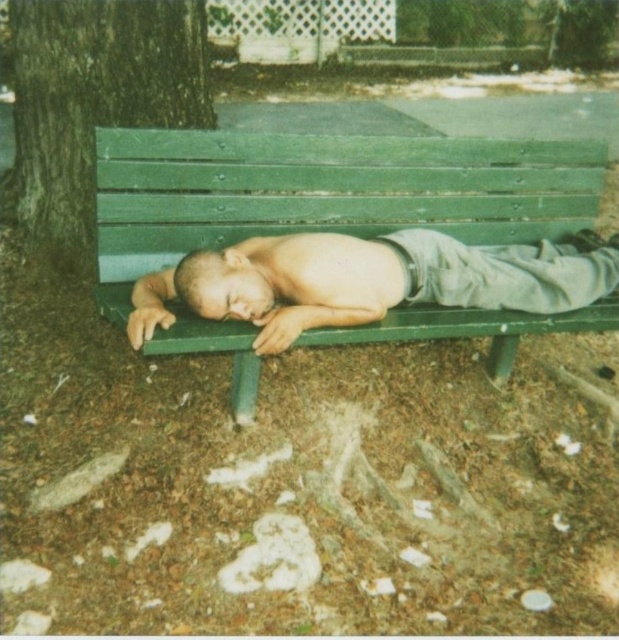
In the scene shown: You are a park ranger who notices the smooth skin man at center and the green painted wood bench at center. Based on their positions, which object is closer to the tree trunk on the left side of the frame?

The green painted wood bench at center is closer to the tree trunk on the left side of the frame because it is positioned to the left of the smooth skin man at center.

You are standing in front of the green wooden bench in the park. There are two points marked on the bench. One is at coordinate point (97, 90) and the other is at point (387, 269). Which of these two points is closer to you?

Point (97, 90) is closer to you because it is further to the camera than point (387, 269).